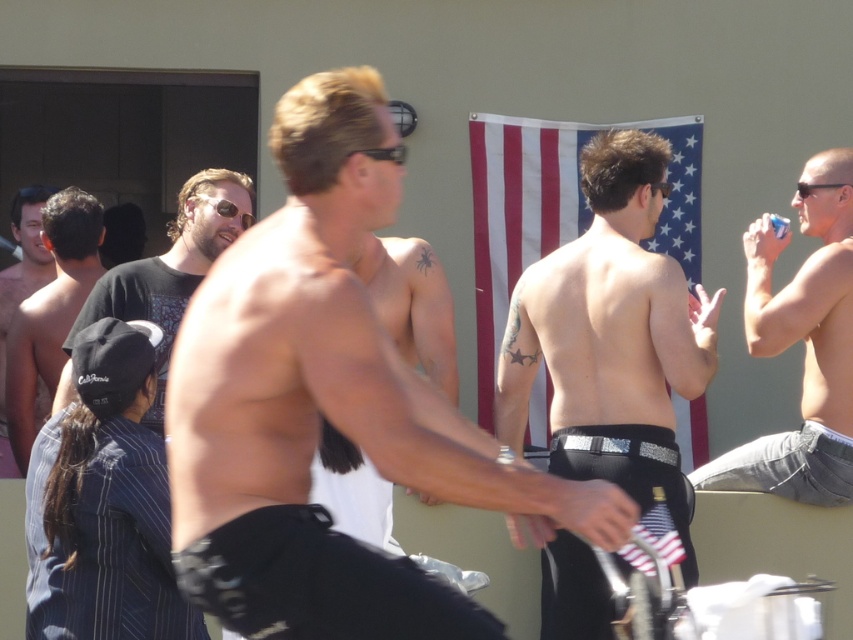
Consider the image. Who is taller, smooth skin torso at center or shiny black shirt at left?

Standing taller between the two is smooth skin torso at center.

Is smooth skin torso at center to the left of shiny black shirt at left from the viewer's perspective?

In fact, smooth skin torso at center is to the right of shiny black shirt at left.

At what (x,y) coordinates should I click in order to perform the action: click on smooth skin torso at center. Please return your answer as a coordinate pair (x, y). Image resolution: width=853 pixels, height=640 pixels. Looking at the image, I should click on (328, 406).

Between black matte t-shirt at center and shiny black shirt at left, which one is positioned lower?

shiny black shirt at left

Is point (129, 284) in front of point (38, 301)?

Yes.

This screenshot has width=853, height=640. Identify the location of black matte t-shirt at center. (173, 266).

Is smooth skin torso at center to the left of clear plastic cup at upper right from the viewer's perspective?

Yes, smooth skin torso at center is to the left of clear plastic cup at upper right.

The height and width of the screenshot is (640, 853). What do you see at coordinates (328, 406) in the screenshot? I see `smooth skin torso at center` at bounding box center [328, 406].

Where is `smooth skin torso at center`? The height and width of the screenshot is (640, 853). smooth skin torso at center is located at coordinates (328, 406).